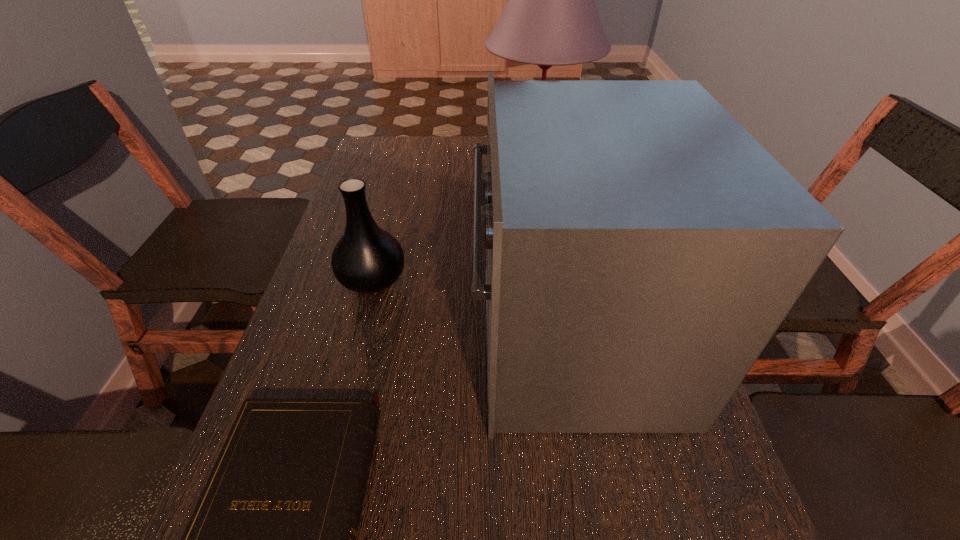
The width and height of the screenshot is (960, 540). I want to click on table lamp, so click(550, 19).

The height and width of the screenshot is (540, 960). Identify the location of the tallest object. [x=550, y=19].

Find the location of a particular element. Image resolution: width=960 pixels, height=540 pixels. the second tallest object is located at coordinates (642, 248).

The height and width of the screenshot is (540, 960). Find the location of `the third tallest object`. the third tallest object is located at coordinates tap(367, 259).

You are a GUI agent. You are given a task and a screenshot of the screen. Output one action in this format:
    pyautogui.click(x=<x>, y=<y>)
    Task: Click on the vacant region located 0.170m on the front-facing side of the tallest object
    This screenshot has height=540, width=960.
    Given the screenshot: What is the action you would take?
    pyautogui.click(x=429, y=167)

Find the location of `vacant region located on the front-facing side of the tallest object`. vacant region located on the front-facing side of the tallest object is located at coordinates (439, 167).

The width and height of the screenshot is (960, 540). I want to click on free space located on the front-facing side of the tallest object, so click(x=458, y=167).

Where is `vacant space located on the front panel of the second tallest object`? vacant space located on the front panel of the second tallest object is located at coordinates (364, 336).

You are a GUI agent. You are given a task and a screenshot of the screen. Output one action in this format:
    pyautogui.click(x=<x>, y=<y>)
    Task: Click on the free space located 0.120m on the front panel of the second tallest object
    
    Given the screenshot: What is the action you would take?
    pyautogui.click(x=414, y=336)

You are a GUI agent. You are given a task and a screenshot of the screen. Output one action in this format:
    pyautogui.click(x=<x>, y=<y>)
    Task: Click on the vacant space situated on the front panel of the second tallest object
    This screenshot has height=540, width=960.
    Given the screenshot: What is the action you would take?
    [x=334, y=336]